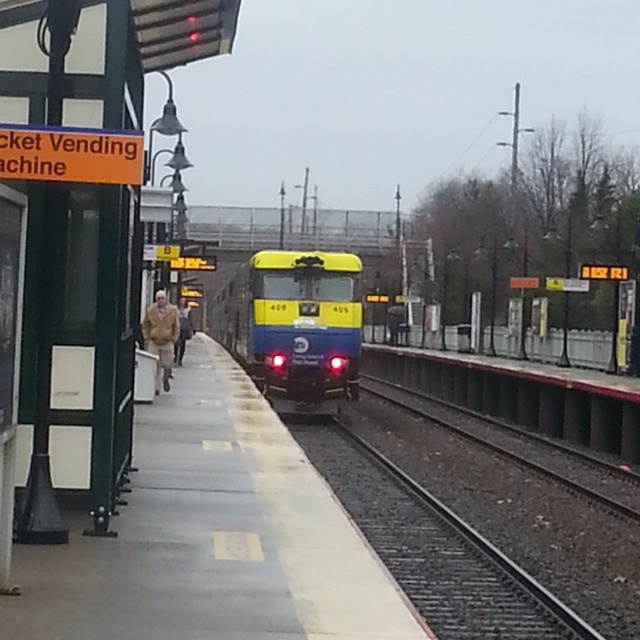
You are a pedestrian trying to cross the platform. You see the smooth concrete platform at center and the brown leather jacket at center. Which object is taller?

The brown leather jacket at center is taller than the smooth concrete platform at center.

You are standing on the platform and want to board the yellow matte train at center. There is a person wearing a brown leather jacket at center blocking your path. Can you walk around them to reach the train?

The yellow matte train at center is further to the viewer than the brown leather jacket at center, so the train is closer to you. Therefore, you can walk around the person in the brown leather jacket at center to reach the train.